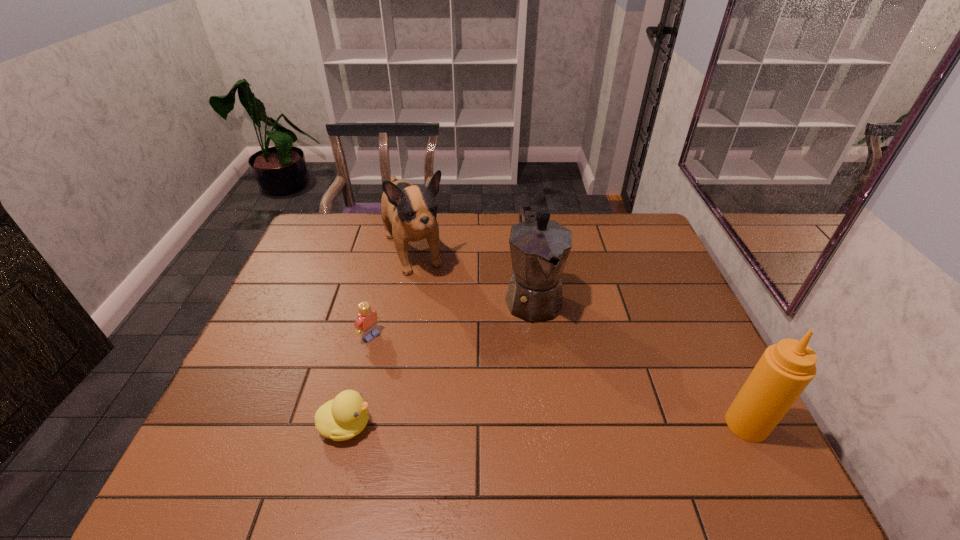
Image resolution: width=960 pixels, height=540 pixels. What are the coordinates of `the shortest object` in the screenshot? It's located at (345, 416).

What are the coordinates of `condiment` in the screenshot? It's located at (785, 369).

Find the location of a particular element. The width and height of the screenshot is (960, 540). Lego is located at coordinates (366, 324).

Identify the location of puppy. (409, 212).

At what (x,y) coordinates should I click in order to perform the action: click on the second object from right to left. Please return your answer as a coordinate pair (x, y). The height and width of the screenshot is (540, 960). Looking at the image, I should click on (539, 247).

Find the location of a particular element. vacant space situated 0.150m at the beak of the shortest object is located at coordinates tap(440, 426).

Locate an element on the screen. The image size is (960, 540). free space located 0.300m on the back of the condiment is located at coordinates (692, 316).

Locate an element on the screen. vacant region located on the front-facing side of the Lego is located at coordinates (396, 354).

The width and height of the screenshot is (960, 540). Identify the location of vacant space situated 0.080m on the front-facing side of the Lego. (398, 356).

Locate an element on the screen. vacant space situated 0.390m on the front-facing side of the Lego is located at coordinates (493, 420).